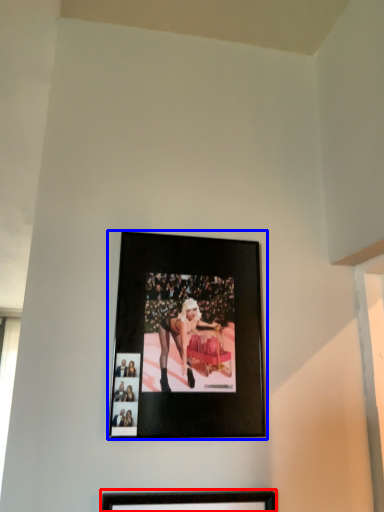
Question: Which point is closer to the camera, picture frame (highlighted by a red box) or picture frame (highlighted by a blue box)?

Choices:
 (A) picture frame
 (B) picture frame

Answer: (A)